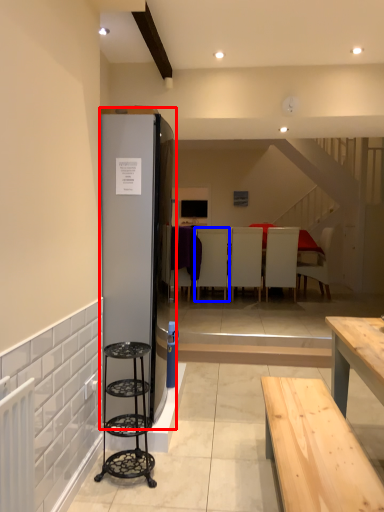
Question: Which object appears closest to the camera in this image, fridge (highlighted by a red box) or armchair (highlighted by a blue box)?

Choices:
 (A) fridge
 (B) armchair

Answer: (A)